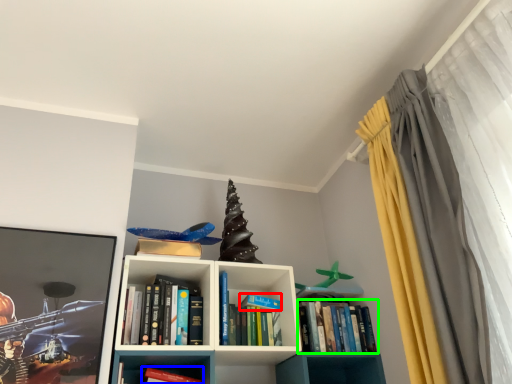
Question: Estimate the real-world distances between objects in this image. Which object is farther from paperback book (highlighted by a red box), book (highlighted by a blue box) or book (highlighted by a green box)?

Choices:
 (A) book
 (B) book

Answer: (A)